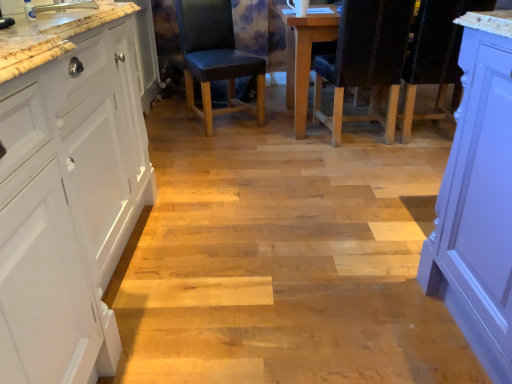
Question: From a real-world perspective, is leather-like black chair at center, arranged as the 1th chair when viewed from the left, below black leather chair at center, arranged as the first chair when viewed from the right?

Choices:
 (A) no
 (B) yes

Answer: (B)

Question: Could you tell me if leather-like black chair at center, which is the second chair in right-to-left order, is facing black leather chair at center, positioned as the second chair in left-to-right order?

Choices:
 (A) no
 (B) yes

Answer: (A)

Question: Is leather-like black chair at center, arranged as the 1th chair when viewed from the left, positioned with its back to black leather chair at center, arranged as the first chair when viewed from the right?

Choices:
 (A) yes
 (B) no

Answer: (B)

Question: Considering the relative sizes of leather-like black chair at center, which is the second chair in right-to-left order, and black leather chair at center, positioned as the second chair in left-to-right order, in the image provided, is leather-like black chair at center, which is the second chair in right-to-left order, taller than black leather chair at center, positioned as the second chair in left-to-right order,?

Choices:
 (A) no
 (B) yes

Answer: (A)

Question: Are leather-like black chair at center, which is the second chair in right-to-left order, and black leather chair at center, arranged as the first chair when viewed from the right, beside each other?

Choices:
 (A) yes
 (B) no

Answer: (B)

Question: Does point (54, 269) appear closer or farther from the camera than point (264, 107)?

Choices:
 (A) closer
 (B) farther

Answer: (A)

Question: From the image's perspective, is white matte cabinet at left located above or below leather-like black chair at center, which is the second chair in right-to-left order?

Choices:
 (A) below
 (B) above

Answer: (A)

Question: Which is correct: white matte cabinet at left is inside leather-like black chair at center, arranged as the 1th chair when viewed from the left, or outside of it?

Choices:
 (A) outside
 (B) inside

Answer: (A)

Question: Is white matte cabinet at left to the left or to the right of leather-like black chair at center, which is the second chair in right-to-left order, in the image?

Choices:
 (A) left
 (B) right

Answer: (A)

Question: In the image, is black leather chair at center, positioned as the second chair in left-to-right order, positioned in front of or behind leather-like black chair at center, arranged as the 1th chair when viewed from the left?

Choices:
 (A) behind
 (B) front

Answer: (B)

Question: From the image's perspective, is black leather chair at center, arranged as the first chair when viewed from the right, positioned above or below leather-like black chair at center, which is the second chair in right-to-left order?

Choices:
 (A) below
 (B) above

Answer: (A)

Question: Is black leather chair at center, positioned as the second chair in left-to-right order, situated inside leather-like black chair at center, which is the second chair in right-to-left order, or outside?

Choices:
 (A) outside
 (B) inside

Answer: (A)

Question: Based on their positions, is black leather chair at center, positioned as the second chair in left-to-right order, located to the left or right of leather-like black chair at center, arranged as the 1th chair when viewed from the left?

Choices:
 (A) right
 (B) left

Answer: (A)

Question: Is leather-like black chair at center, which is the second chair in right-to-left order, taller or shorter than white matte cabinet at left?

Choices:
 (A) tall
 (B) short

Answer: (B)

Question: Would you say leather-like black chair at center, which is the second chair in right-to-left order, is inside or outside white matte cabinet at left?

Choices:
 (A) outside
 (B) inside

Answer: (A)